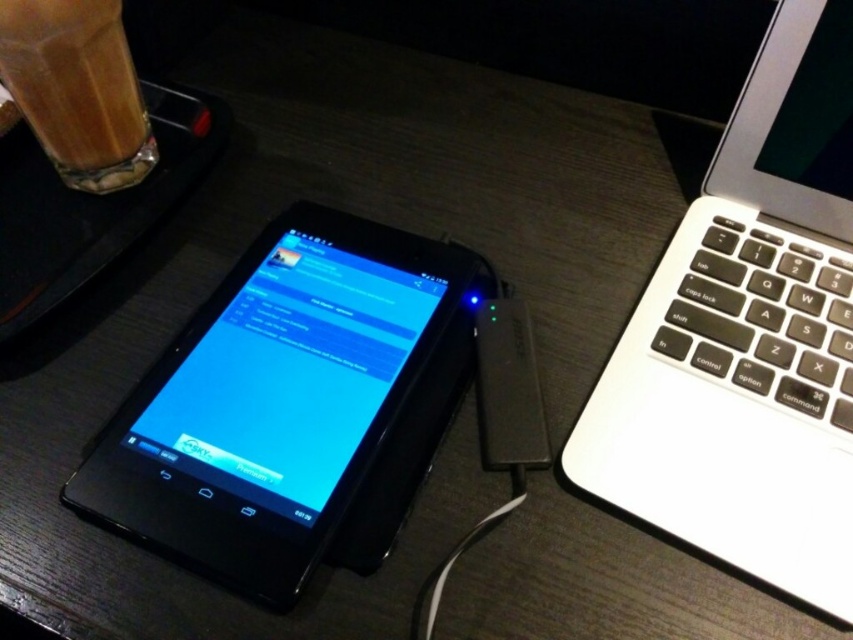
Is brown translucent glass at upper left positioned behind white plastic ipod at center?

Yes, brown translucent glass at upper left is further from the viewer.

Can you confirm if brown translucent glass at upper left is positioned above white plastic ipod at center?

Yes.

Is point (55, 168) positioned behind point (518, 346)?

Yes, it is behind point (518, 346).

Locate an element on the screen. brown translucent glass at upper left is located at coordinates [x=77, y=90].

Does point (228, 413) lie in front of point (508, 342)?

That is True.

Is point (221, 472) positioned after point (506, 385)?

No, it is in front of (506, 385).

Locate an element on the screen. This screenshot has height=640, width=853. black glossy tablet at center is located at coordinates (274, 400).

Which is more to the left, silver metallic laptop at upper right or white plastic ipod at center?

Positioned to the left is white plastic ipod at center.

Is silver metallic laptop at upper right smaller than white plastic ipod at center?

Incorrect, silver metallic laptop at upper right is not smaller in size than white plastic ipod at center.

Find the location of a particular element. silver metallic laptop at upper right is located at coordinates (749, 337).

You are a GUI agent. You are given a task and a screenshot of the screen. Output one action in this format:
    pyautogui.click(x=<x>, y=<y>)
    Task: Click on the silver metallic laptop at upper right
    Image resolution: width=853 pixels, height=640 pixels.
    Given the screenshot: What is the action you would take?
    pyautogui.click(x=749, y=337)